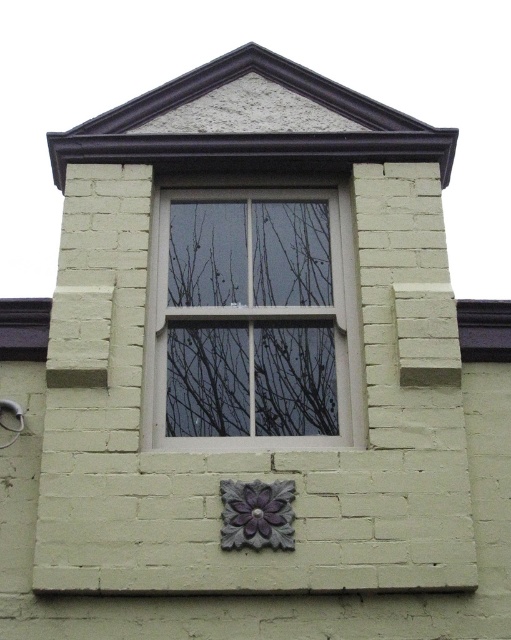
Which of these two, white wood window at center or purple matte flower at lower center, stands taller?

Standing taller between the two is white wood window at center.

Does white wood window at center appear on the right side of purple matte flower at lower center?

No, white wood window at center is not to the right of purple matte flower at lower center.

In order to click on white wood window at center in this screenshot , I will do `click(252, 316)`.